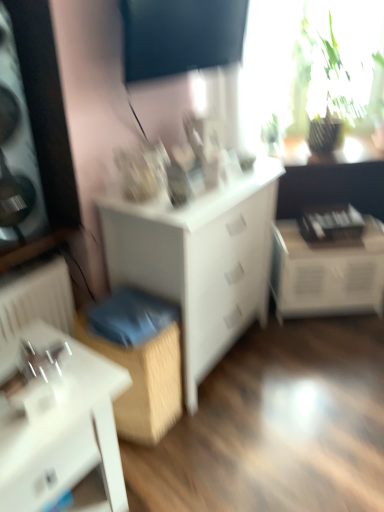
In order to click on dark matte screen at upper center, placed as the first window screen when sorted from left to right in this screenshot , I will do [180, 36].

In order to face white glossy table at lower left, which ranks as the 1th table in front-to-back order, should I rotate leftwards or rightwards?

You should look left and rotate roughly 19.529 degrees.

Image resolution: width=384 pixels, height=512 pixels. Describe the element at coordinates (307, 58) in the screenshot. I see `green leafy plant at upper right, marked as the 2th window screen in a left-to-right arrangement` at that location.

Locate an element on the screen. green leafy plant at upper right, marked as the 2th window screen in a left-to-right arrangement is located at coordinates (307, 58).

The image size is (384, 512). What are the coordinates of `dark matte screen at upper center, the 2th window screen positioned from the right` in the screenshot? It's located at (180, 36).

How many degrees apart are the facing directions of dark matte screen at upper center, which appears as the first window screen when viewed from the front, and white matte chest of drawers at center?

They differ by 4.26 degrees in their facing directions.

Considering the sizes of dark matte screen at upper center, the 2th window screen positioned from the right, and white matte chest of drawers at center in the image, is dark matte screen at upper center, the 2th window screen positioned from the right, taller or shorter than white matte chest of drawers at center?

Considering their sizes, dark matte screen at upper center, the 2th window screen positioned from the right, has less height than white matte chest of drawers at center.

From the image's perspective, between dark matte screen at upper center, which appears as the first window screen when viewed from the front, and white matte chest of drawers at center, who is located below?

white matte chest of drawers at center is shown below in the image.

Relative to white matte chest of drawers at center, is dark matte screen at upper center, the 2th window screen positioned from the right, in front or behind?

In the image, dark matte screen at upper center, the 2th window screen positioned from the right, appears in front of white matte chest of drawers at center.

You are a GUI agent. You are given a task and a screenshot of the screen. Output one action in this format:
    pyautogui.click(x=<x>, y=<y>)
    Task: Click on the table that appears on the left of white glossy table at lower right, the second table viewed from the left
    The height and width of the screenshot is (512, 384).
    Given the screenshot: What is the action you would take?
    pyautogui.click(x=58, y=422)

Can we say white glossy table at lower right, the second table viewed from the left, lies outside white glossy table at lower left, the 2th table in the top-to-bottom sequence?

That's correct, white glossy table at lower right, the second table viewed from the left, is outside of white glossy table at lower left, the 2th table in the top-to-bottom sequence.

Is white glossy table at lower right, placed as the 2th table when sorted from bottom to top, placed right next to white glossy table at lower left, the 2th table in the top-to-bottom sequence?

white glossy table at lower right, placed as the 2th table when sorted from bottom to top, is not next to white glossy table at lower left, the 2th table in the top-to-bottom sequence, and they're not touching.

Who is taller, white glossy table at lower right, which is the 1th table in back-to-front order, or white glossy table at lower left, which ranks as the 1th table in front-to-back order?

white glossy table at lower left, which ranks as the 1th table in front-to-back order.

The image size is (384, 512). What are the coordinates of `window screen that appears in front of the green leafy plant at upper right, which is counted as the second window screen, starting from the front` in the screenshot? It's located at (180, 36).

Can you confirm if green leafy plant at upper right, the first window screen in the back-to-front sequence, is thinner than dark matte screen at upper center, which appears as the first window screen when viewed from the front?

In fact, green leafy plant at upper right, the first window screen in the back-to-front sequence, might be wider than dark matte screen at upper center, which appears as the first window screen when viewed from the front.

From a real-world perspective, which is physically below, green leafy plant at upper right, marked as the 2th window screen in a left-to-right arrangement, or dark matte screen at upper center, which appears as the first window screen when viewed from the front?

green leafy plant at upper right, marked as the 2th window screen in a left-to-right arrangement, is physically lower.

Between wooden box at lower center and white glossy table at lower left, the 1th table from the bottom, which one has larger width?

Wider between the two is white glossy table at lower left, the 1th table from the bottom.

Based on the photo, can you confirm if wooden box at lower center is positioned to the right of white glossy table at lower left, marked as the first table in a left-to-right arrangement?

Yes, wooden box at lower center is to the right of white glossy table at lower left, marked as the first table in a left-to-right arrangement.

Locate an element on the screen. Image resolution: width=384 pixels, height=512 pixels. table on the right of white matte chest of drawers at center is located at coordinates (327, 272).

Is white matte chest of drawers at center touching white glossy table at lower right, placed as the first table when sorted from top to bottom?

white matte chest of drawers at center and white glossy table at lower right, placed as the first table when sorted from top to bottom, are not in contact.

From a real-world perspective, is white matte chest of drawers at center located higher than white glossy table at lower right, which is the 1th table in back-to-front order?

Yes, from a real-world perspective, white matte chest of drawers at center is on top of white glossy table at lower right, which is the 1th table in back-to-front order.

Consider the image. Who is smaller, white matte chest of drawers at center or white glossy table at lower right, placed as the first table when sorted from top to bottom?

white glossy table at lower right, placed as the first table when sorted from top to bottom.

Is wooden box at lower center facing away from white glossy table at lower right, placed as the 2th table when sorted from bottom to top?

wooden box at lower center does not have its back to white glossy table at lower right, placed as the 2th table when sorted from bottom to top.

Is wooden box at lower center to the left or to the right of white glossy table at lower right, the second table viewed from the left, in the image?

Based on their positions, wooden box at lower center is located to the left of white glossy table at lower right, the second table viewed from the left.

Does wooden box at lower center have a smaller size compared to white glossy table at lower right, the second table positioned from the front?

Yes, wooden box at lower center is smaller than white glossy table at lower right, the second table positioned from the front.

Find the location of `table lying above the wooden box at lower center (from the image's perspective)`. table lying above the wooden box at lower center (from the image's perspective) is located at coordinates (327, 272).

Starting from the white glossy table at lower left, which ranks as the 1th table in front-to-back order, which window screen is the 1st one to the right? Please provide its 2D coordinates.

[(180, 36)]

Is dark matte screen at upper center, which appears as the first window screen when viewed from the front, to the right of white glossy table at lower left, the second table from the right, from the viewer's perspective?

Indeed, dark matte screen at upper center, which appears as the first window screen when viewed from the front, is positioned on the right side of white glossy table at lower left, the second table from the right.

Which is further, (156, 34) or (110, 431)?

Positioned behind is point (156, 34).

You are a GUI agent. You are given a task and a screenshot of the screen. Output one action in this format:
    pyautogui.click(x=<x>, y=<y>)
    Task: Click on the chest of drawers that is on the right side of dark matte screen at upper center, placed as the first window screen when sorted from left to right
    This screenshot has width=384, height=512.
    Given the screenshot: What is the action you would take?
    pyautogui.click(x=200, y=260)

Locate an element on the screen. Image resolution: width=384 pixels, height=512 pixels. table below the white glossy table at lower right, which is the 1th table in back-to-front order (from the image's perspective) is located at coordinates 58,422.

When comparing their distances from white glossy table at lower left, which ranks as the 1th table in front-to-back order, does white glossy table at lower right, placed as the 2th table when sorted from bottom to top, or dark matte screen at upper center, placed as the first window screen when sorted from left to right, seem further?

white glossy table at lower right, placed as the 2th table when sorted from bottom to top, is positioned further to the anchor white glossy table at lower left, which ranks as the 1th table in front-to-back order.

Based on their spatial positions, is wooden box at lower center or white glossy table at lower left, the second table from the right, closer to green leafy plant at upper right, which appears as the first window screen when viewed from the right?

wooden box at lower center.

Considering their positions, is green leafy plant at upper right, marked as the 2th window screen in a left-to-right arrangement, positioned closer to wooden box at lower center than white glossy table at lower right, the second table positioned from the front?

white glossy table at lower right, the second table positioned from the front, is positioned closer to the anchor wooden box at lower center.

Estimate the real-world distances between objects in this image. Which object is further from wooden box at lower center, white glossy table at lower right, which is the 1th table in back-to-front order, or white glossy table at lower left, the 1th table from the bottom?

Based on the image, white glossy table at lower right, which is the 1th table in back-to-front order, appears to be further to wooden box at lower center.

Estimate the real-world distances between objects in this image. Which object is further from dark matte screen at upper center, which appears as the first window screen when viewed from the front, white matte chest of drawers at center or white glossy table at lower left, the 1th table from the bottom?

white glossy table at lower left, the 1th table from the bottom.

Estimate the real-world distances between objects in this image. Which object is closer to white glossy table at lower left, which ranks as the 1th table in front-to-back order, white glossy table at lower right, placed as the 2th table when sorted from bottom to top, or green leafy plant at upper right, marked as the 2th window screen in a left-to-right arrangement?

The object closer to white glossy table at lower left, which ranks as the 1th table in front-to-back order, is white glossy table at lower right, placed as the 2th table when sorted from bottom to top.

Looking at the image, which one is located further to white glossy table at lower left, which ranks as the 1th table in front-to-back order, white matte chest of drawers at center or white glossy table at lower right, the second table positioned from the front?

white glossy table at lower right, the second table positioned from the front, is positioned further to the anchor white glossy table at lower left, which ranks as the 1th table in front-to-back order.

From the image, which object appears to be farther from green leafy plant at upper right, which appears as the first window screen when viewed from the right, dark matte screen at upper center, placed as the first window screen when sorted from left to right, or white glossy table at lower right, the first table from the right?

white glossy table at lower right, the first table from the right, is further to green leafy plant at upper right, which appears as the first window screen when viewed from the right.

Find the location of a particular element. The height and width of the screenshot is (512, 384). table between green leafy plant at upper right, marked as the 2th window screen in a left-to-right arrangement, and wooden box at lower center, in the vertical direction is located at coordinates (327, 272).

At what (x,y) coordinates should I click in order to perform the action: click on window screen between green leafy plant at upper right, which is counted as the second window screen, starting from the front, and white glossy table at lower right, which is the 1th table in back-to-front order, in the vertical direction. Please return your answer as a coordinate pair (x, y). Looking at the image, I should click on (180, 36).

The height and width of the screenshot is (512, 384). I want to click on window screen between green leafy plant at upper right, which is counted as the second window screen, starting from the front, and white matte chest of drawers at center, in the vertical direction, so click(x=180, y=36).

Image resolution: width=384 pixels, height=512 pixels. Identify the location of table between dark matte screen at upper center, the 2th window screen positioned from the right, and wooden box at lower center from top to bottom. (327, 272).